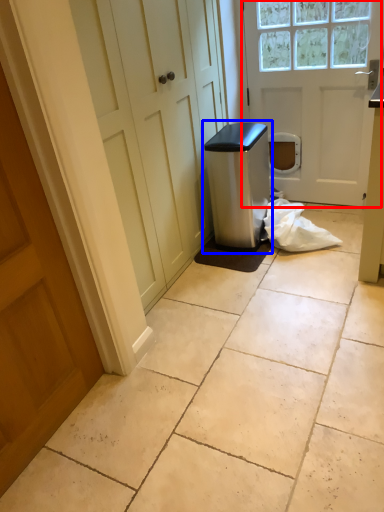
Question: Which object appears closest to the camera in this image, door (highlighted by a red box) or water cooler (highlighted by a blue box)?

Choices:
 (A) door
 (B) water cooler

Answer: (A)